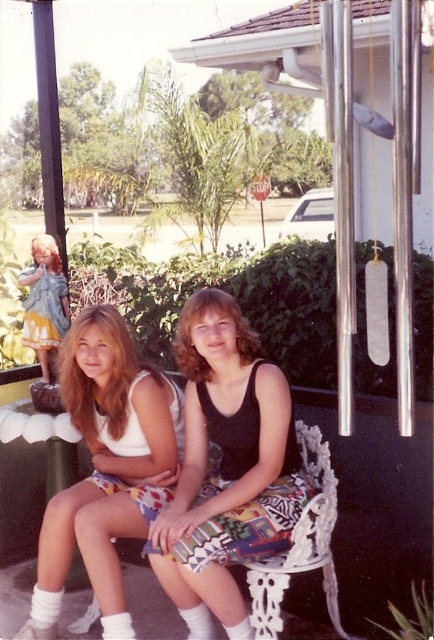
You are a photographer trying to capture the two people sitting on the decorative white chair with intricate cutout patterns. You notice a point at coordinates (226,467) which marks the location of the black matte tank top at center. If you want to focus your camera on the black matte tank top at center, which person should you aim the camera at?

The point at coordinates (226,467) marks the location of the black matte tank top at center, which belongs to the person on the right wearing a black sleeveless top and a similarly patterned skirt. Therefore, you should aim the camera at the person on the right.

You are a photographer trying to capture the white fabric tank top at left in the image. If you want to focus on it, where should you adjust your camera to point?

The white fabric tank top at left is located at point 0.730 on the x axis and 0.247 on the y axis, so you should adjust your camera to point to that coordinate to focus on it.